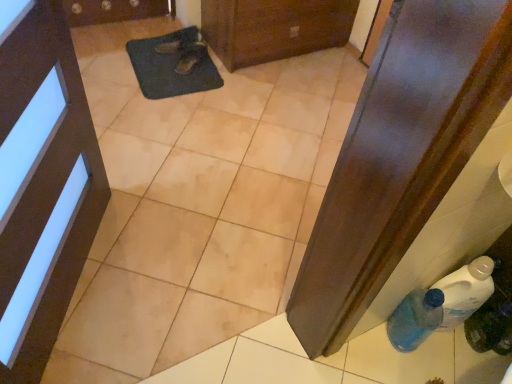
This screenshot has height=384, width=512. I want to click on free spot in front of blue translucent bottle at lower right, the 2th bottle positioned from the right, so click(x=399, y=367).